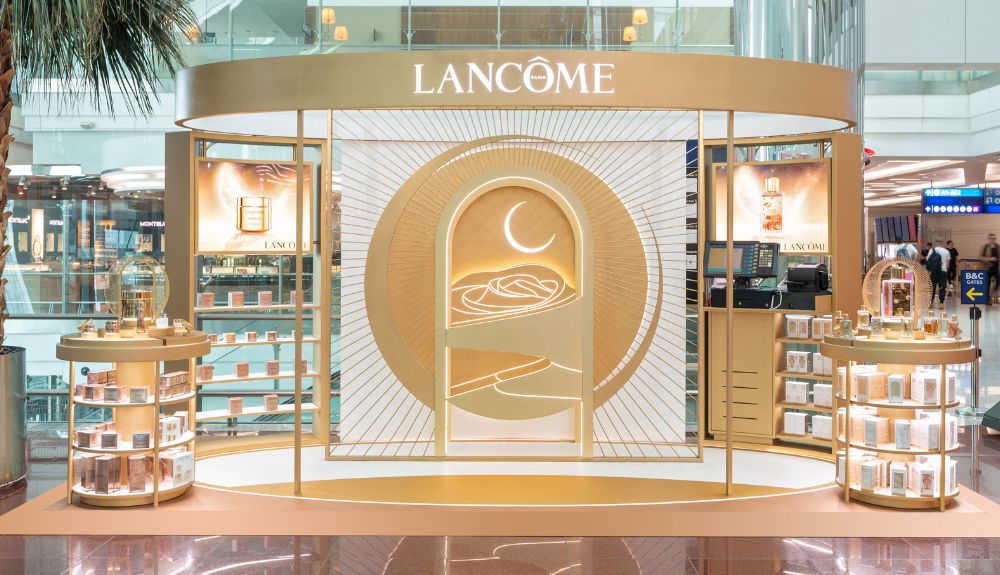
Identify the location of tile floor. The image size is (1000, 575). coord(570,554).